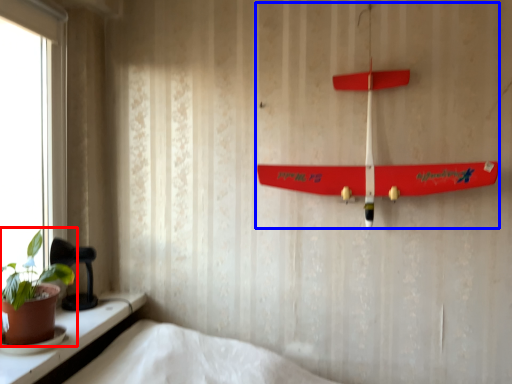
Question: Which object is further to the camera taking this photo, houseplant (highlighted by a red box) or toy (highlighted by a blue box)?

Choices:
 (A) houseplant
 (B) toy

Answer: (B)